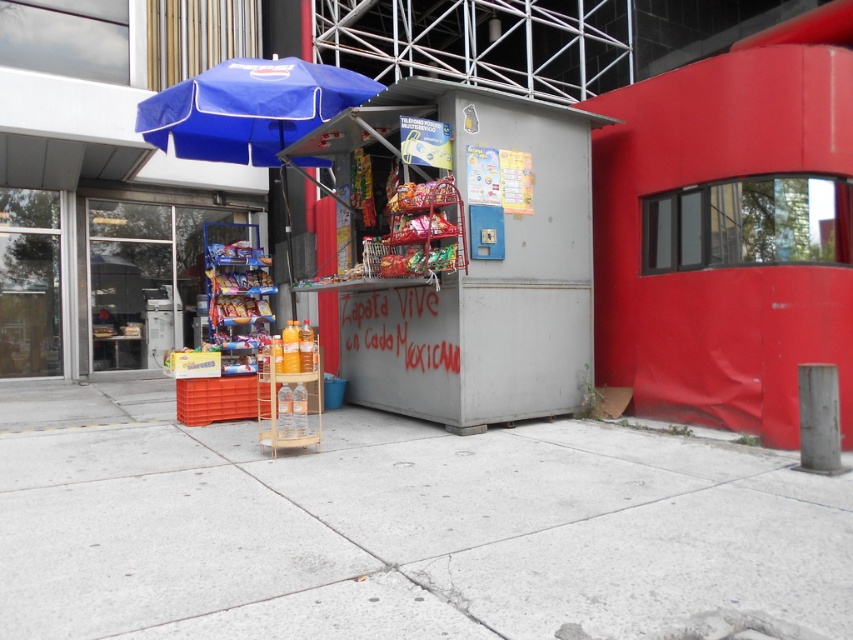
At what (x,y) coordinates should I click in order to perform the action: click on metallic gray kiosk at center. Please return your answer as a coordinate pair (x, y). The width and height of the screenshot is (853, 640). Looking at the image, I should click on (482, 268).

Who is lower down, metallic gray kiosk at center or blue fabric umbrella at upper left?

metallic gray kiosk at center is below.

Find the location of a particular element. Image resolution: width=853 pixels, height=640 pixels. metallic gray kiosk at center is located at coordinates (482, 268).

Locate an element on the screen. metallic gray kiosk at center is located at coordinates (482, 268).

The height and width of the screenshot is (640, 853). What do you see at coordinates (412, 532) in the screenshot?
I see `concrete at center` at bounding box center [412, 532].

Find the location of `concrete at center`. concrete at center is located at coordinates (412, 532).

Does concrete at center have a lesser height compared to metallic gray kiosk at center?

Yes, concrete at center is shorter than metallic gray kiosk at center.

Describe the element at coordinates (412, 532) in the screenshot. I see `concrete at center` at that location.

The height and width of the screenshot is (640, 853). I want to click on concrete at center, so click(412, 532).